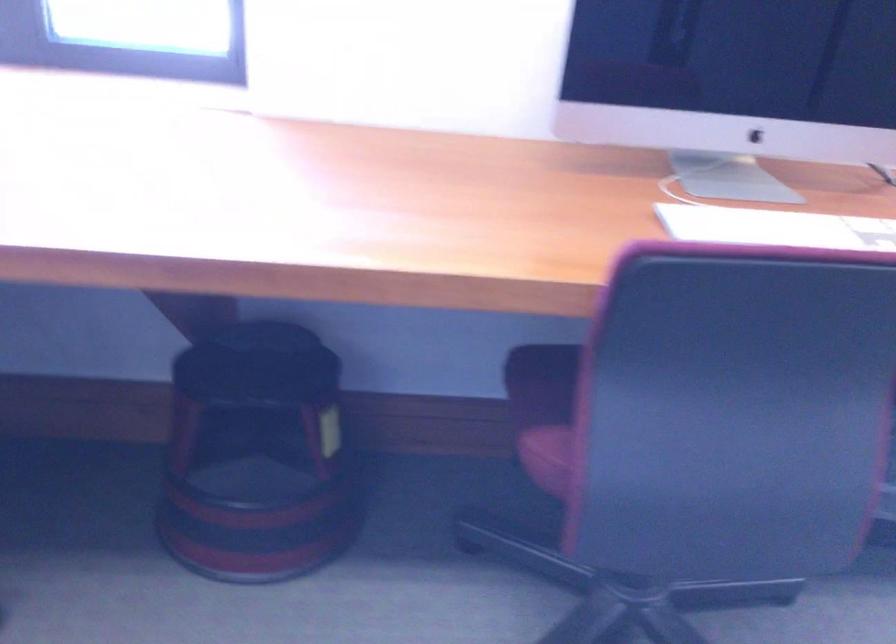
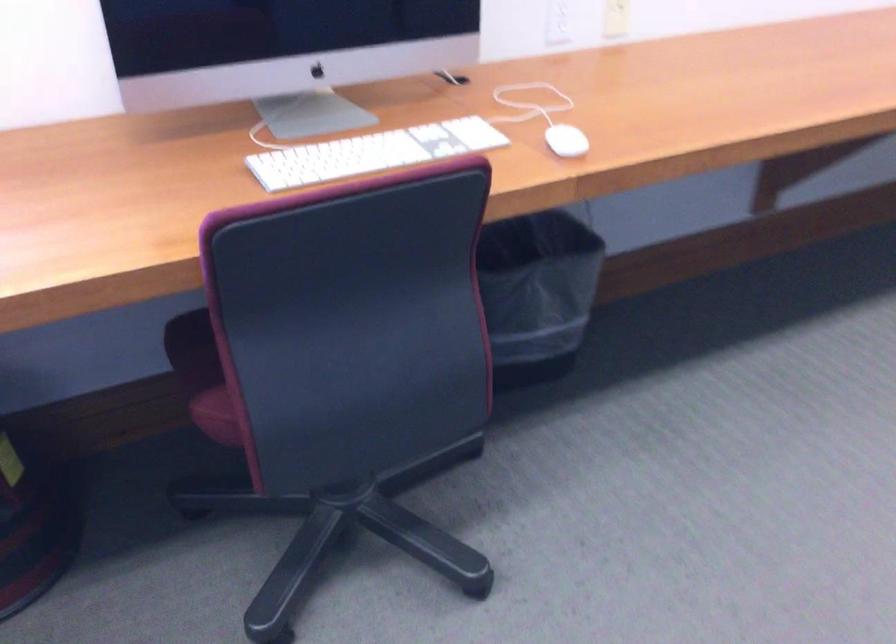
Find the pixel in the second image that matches (547,451) in the first image.

(220, 413)